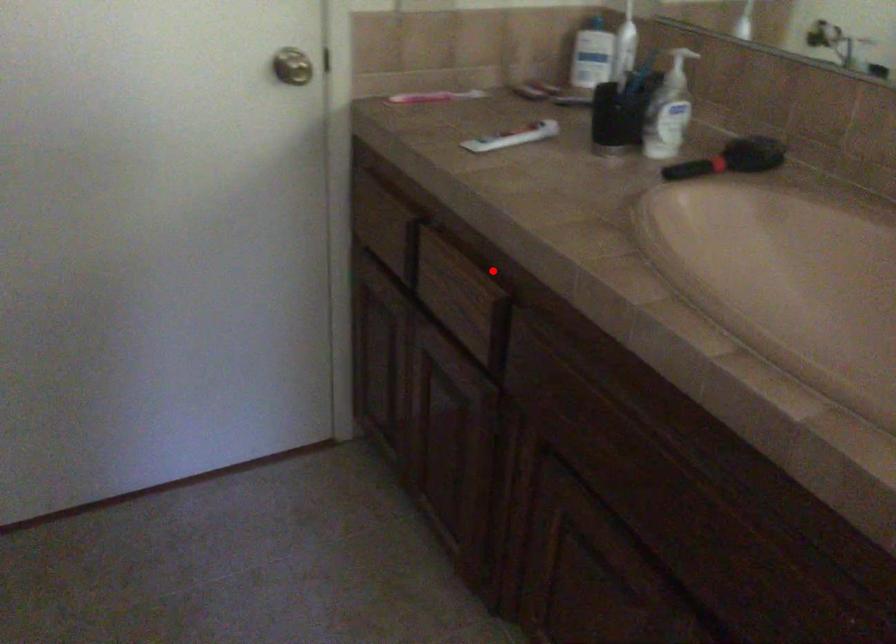
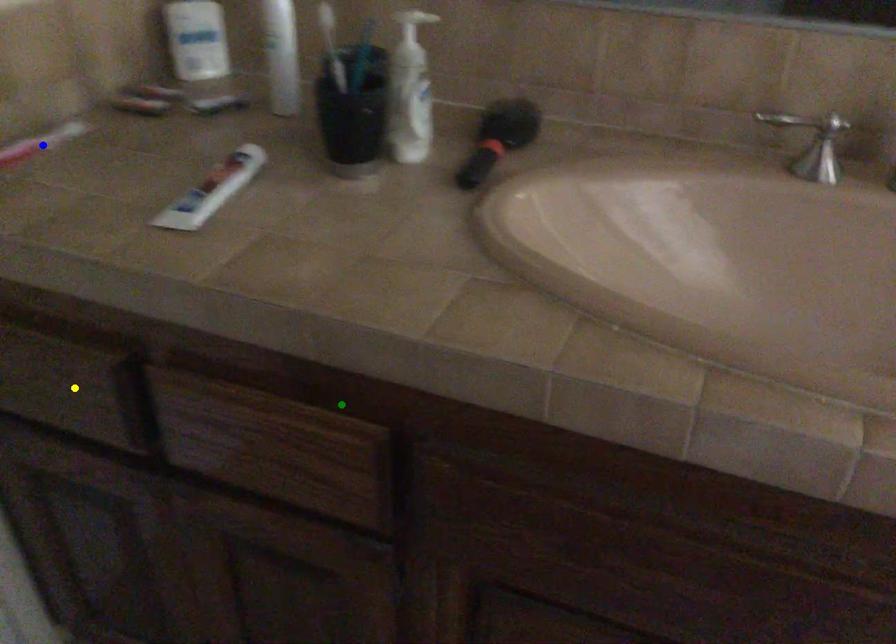
Question: I am providing you with two images of the same scene from different viewpoints. A red point is marked on the first image. You are given multiple points on the second image. Which point in image 2 represents the same 3d spot as the red point in image 1?

Choices:
 (A) blue point
 (B) yellow point
 (C) green point

Answer: (C)